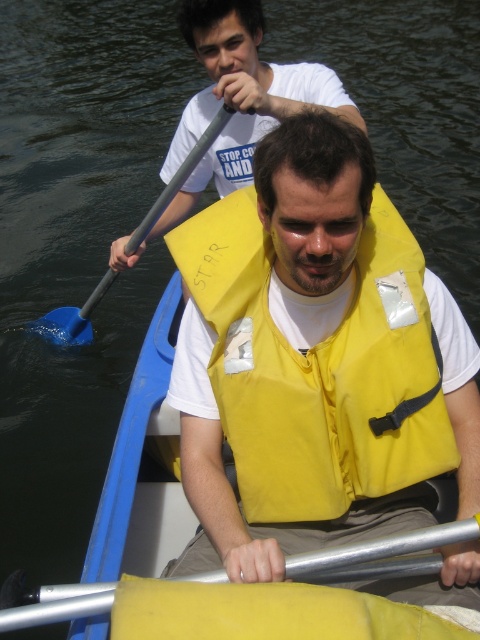
You are a safety inspector checking the boat for safety compliance. The safety regulations state that all life vests must be within 1.5 meters of their corresponding paddles to ensure quick access during emergencies. Based on the scene, are the yellow life vest at center and yellow rubber paddle at center in compliance with this regulation?

The yellow life vest at center and yellow rubber paddle at center are 1.65 meters apart, which exceeds the 1.5 meters requirement. Therefore, they are not in compliance with the safety regulation.